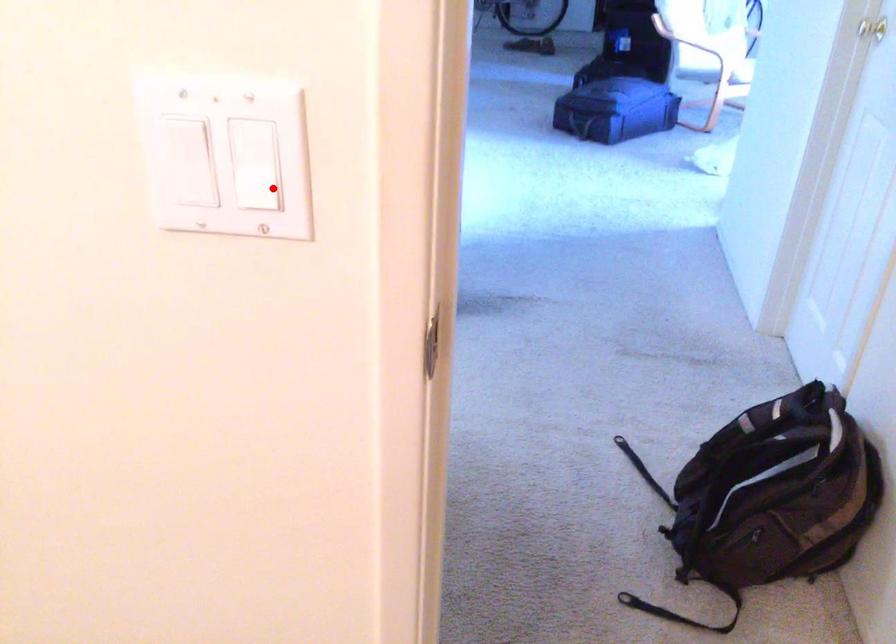
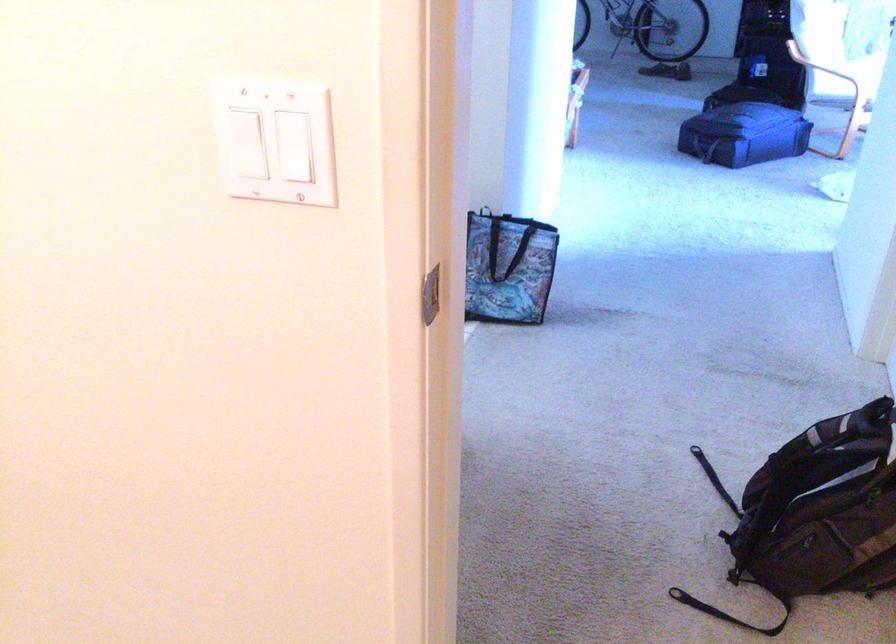
Find the pixel in the second image that matches the highlighted location in the first image.

(294, 146)